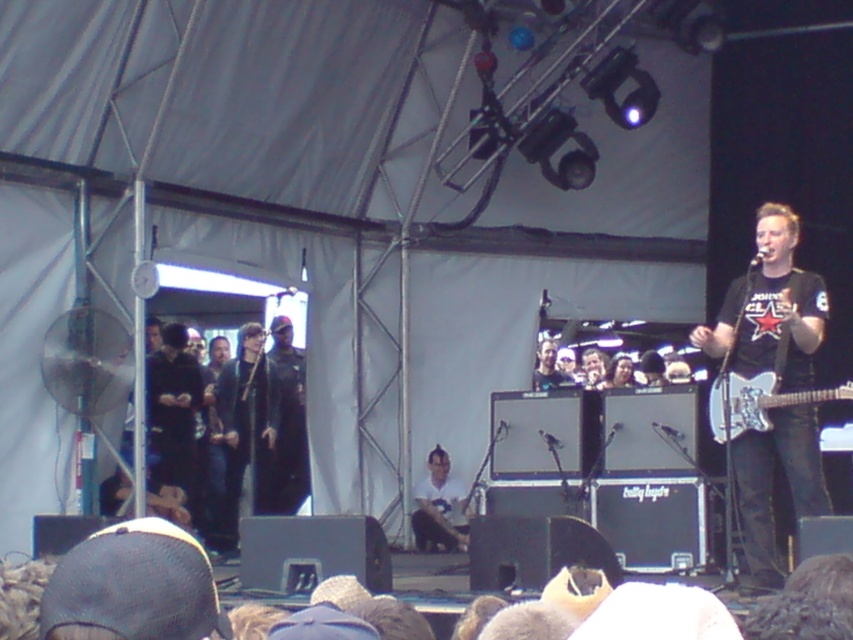
Question: Among these points, which one is farthest from the camera?

Choices:
 (A) (757, 540)
 (B) (741, 406)

Answer: (B)

Question: Can you confirm if black leather jacket at center is positioned below metallic silver guitar at center?

Choices:
 (A) yes
 (B) no

Answer: (B)

Question: Which object is the farthest from the black leather jacket at left?

Choices:
 (A) matte black guitar at center
 (B) black leather jacket at center
 (C) white glossy electric guitar at right
 (D) metallic silver guitar at center

Answer: (A)

Question: Does black leather jacket at center come behind black leather jacket at left?

Choices:
 (A) yes
 (B) no

Answer: (A)

Question: Which is farther from the white glossy electric guitar at right?

Choices:
 (A) black leather jacket at center
 (B) metallic silver guitar at center
 (C) black leather jacket at left

Answer: (A)

Question: Can you confirm if matte black guitar at center is positioned to the left of black leather jacket at center?

Choices:
 (A) no
 (B) yes

Answer: (A)